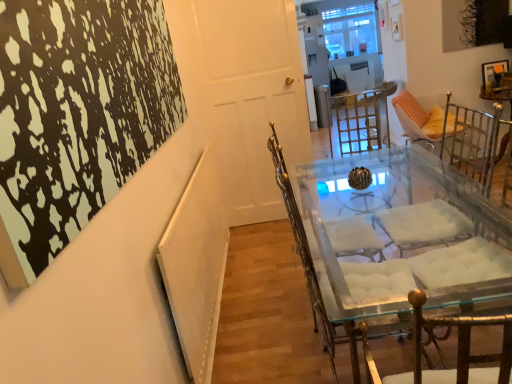
Question: From a real-world perspective, does clear glass chair at center stand above clear glass table at center?

Choices:
 (A) yes
 (B) no

Answer: (B)

Question: Is clear glass chair at center oriented away from clear glass table at center?

Choices:
 (A) no
 (B) yes

Answer: (A)

Question: Considering the relative sizes of clear glass chair at center and clear glass table at center in the image provided, is clear glass chair at center taller than clear glass table at center?

Choices:
 (A) no
 (B) yes

Answer: (B)

Question: Is clear glass chair at center at the left side of clear glass table at center?

Choices:
 (A) no
 (B) yes

Answer: (B)

Question: From a real-world perspective, does clear glass chair at center sit lower than clear glass table at center?

Choices:
 (A) no
 (B) yes

Answer: (B)

Question: Which is correct: white glossy door at center is inside clear glass chair at center, or outside of it?

Choices:
 (A) outside
 (B) inside

Answer: (A)

Question: In terms of width, does white glossy door at center look wider or thinner when compared to clear glass chair at center?

Choices:
 (A) wide
 (B) thin

Answer: (B)

Question: Looking at the image, does white glossy door at center seem bigger or smaller compared to clear glass chair at center?

Choices:
 (A) small
 (B) big

Answer: (A)

Question: From the image's perspective, relative to clear glass chair at center, is white glossy door at center above or below?

Choices:
 (A) above
 (B) below

Answer: (A)

Question: Is clear glass table at center taller or shorter than white glossy door at center?

Choices:
 (A) tall
 (B) short

Answer: (B)

Question: In the image, is clear glass table at center positioned in front of or behind white glossy door at center?

Choices:
 (A) front
 (B) behind

Answer: (A)

Question: Considering the positions of point [493, 254] and point [292, 14], is point [493, 254] closer or farther from the camera than point [292, 14]?

Choices:
 (A) farther
 (B) closer

Answer: (B)

Question: Is clear glass table at center spatially inside white glossy door at center, or outside of it?

Choices:
 (A) outside
 (B) inside

Answer: (A)

Question: From the image's perspective, is clear glass table at center above or below clear glass chair at center?

Choices:
 (A) above
 (B) below

Answer: (B)

Question: In terms of width, does clear glass table at center look wider or thinner when compared to clear glass chair at center?

Choices:
 (A) thin
 (B) wide

Answer: (A)